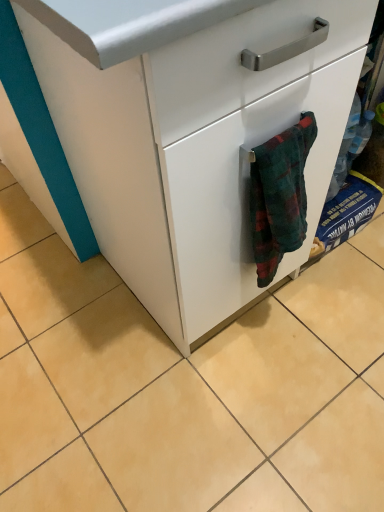
Question: Visually, is flannel bath towel at lower right positioned to the left or to the right of white matte cabinet at center?

Choices:
 (A) left
 (B) right

Answer: (A)

Question: Is flannel bath towel at lower right wider or thinner than white matte cabinet at center?

Choices:
 (A) wide
 (B) thin

Answer: (B)

Question: Is point (274, 173) positioned closer to the camera than point (220, 110)?

Choices:
 (A) closer
 (B) farther

Answer: (B)

Question: Looking at their shapes, would you say white matte cabinet at center is wider or thinner than flannel bath towel at lower right?

Choices:
 (A) thin
 (B) wide

Answer: (B)

Question: Is white matte cabinet at center inside or outside of flannel bath towel at lower right?

Choices:
 (A) outside
 (B) inside

Answer: (A)

Question: Considering their positions, is white matte cabinet at center located in front of or behind flannel bath towel at lower right?

Choices:
 (A) front
 (B) behind

Answer: (A)

Question: From a real-world perspective, is white matte cabinet at center physically located above or below flannel bath towel at lower right?

Choices:
 (A) above
 (B) below

Answer: (B)